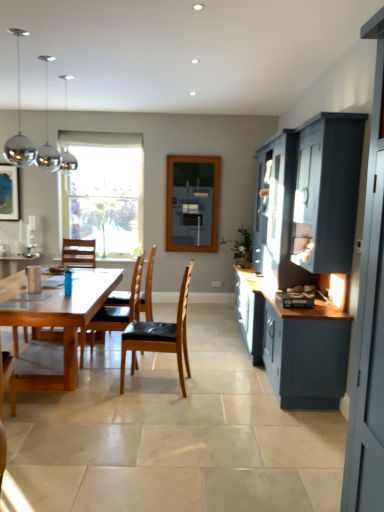
The image size is (384, 512). In order to click on vacant area that lies to the right of light brown wooden chair at center, positioned as the third chair in back-to-front order in this screenshot , I will do `click(208, 390)`.